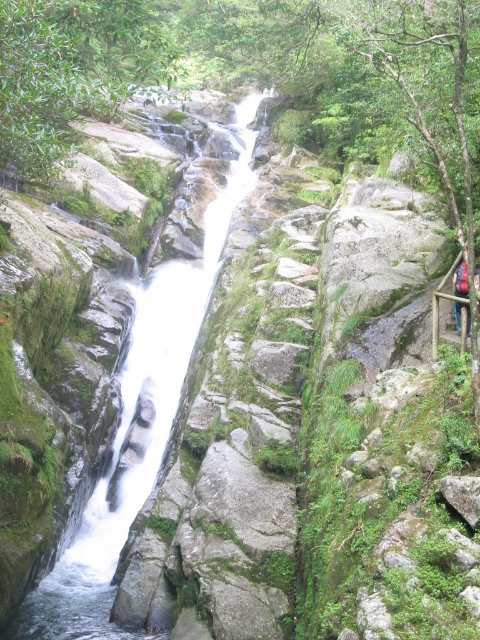
Which of these two, white smooth stream at center or camouflage fabric backpack at right, stands shorter?

With less height is camouflage fabric backpack at right.

Is white smooth stream at center positioned behind camouflage fabric backpack at right?

Yes, it is behind camouflage fabric backpack at right.

Between point (156, 408) and point (462, 305), which one is positioned behind?

Positioned behind is point (156, 408).

The width and height of the screenshot is (480, 640). Find the location of `white smooth stream at center`. white smooth stream at center is located at coordinates (133, 413).